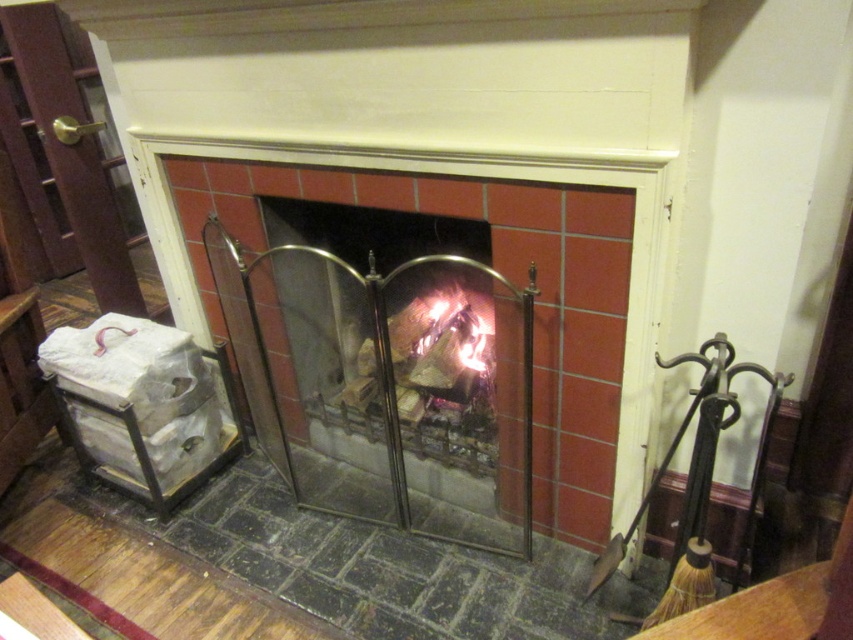
You are a firefighter assessing the scene. You see the matte metal fireplace screen at center and the charcoal wood fire at center. Which object takes up more space in the image?

The matte metal fireplace screen at center is larger in size than the charcoal wood fire at center, so it takes up more space in the image.

You are a firefighter assessing the scene. You notice the matte metal fireplace screen at center and the charcoal wood fire at center. Which object is wider?

The matte metal fireplace screen at center is wider than the charcoal wood fire at center.